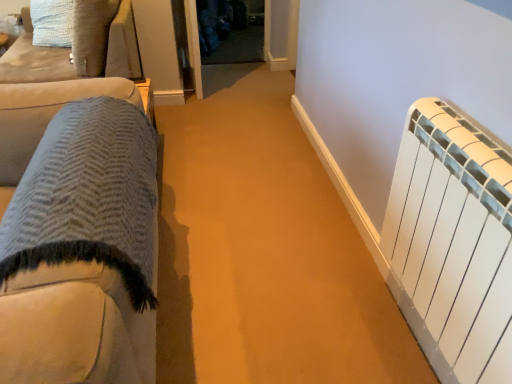
Question: Considering the relative positions of textured wool blanket at left, positioned as the 2th furniture in top-to-bottom order, and transparent glass door at center in the image provided, is textured wool blanket at left, positioned as the 2th furniture in top-to-bottom order, to the left of transparent glass door at center from the viewer's perspective?

Choices:
 (A) yes
 (B) no

Answer: (A)

Question: Can you confirm if textured wool blanket at left, acting as the 1th furniture starting from the right, is positioned to the right of transparent glass door at center?

Choices:
 (A) yes
 (B) no

Answer: (B)

Question: Is textured wool blanket at left, the first furniture from the front, not near transparent glass door at center?

Choices:
 (A) no
 (B) yes

Answer: (B)

Question: Could you tell me if textured wool blanket at left, which is counted as the 2th furniture, starting from the back, is turned towards transparent glass door at center?

Choices:
 (A) yes
 (B) no

Answer: (B)

Question: Would you say transparent glass door at center is part of textured wool blanket at left, which is counted as the 2th furniture, starting from the back,'s contents?

Choices:
 (A) no
 (B) yes

Answer: (A)

Question: From the image's perspective, relative to white matte radiator at right, is suede cushion at upper left, positioned as the 2th furniture in right-to-left order, above or below?

Choices:
 (A) below
 (B) above

Answer: (B)

Question: Based on their sizes in the image, would you say suede cushion at upper left, placed as the first furniture when sorted from back to front, is bigger or smaller than white matte radiator at right?

Choices:
 (A) big
 (B) small

Answer: (A)

Question: In terms of width, does suede cushion at upper left, which ranks as the first furniture in left-to-right order, look wider or thinner when compared to white matte radiator at right?

Choices:
 (A) thin
 (B) wide

Answer: (B)

Question: From a real-world perspective, is suede cushion at upper left, arranged as the second furniture when viewed from the front, above or below white matte radiator at right?

Choices:
 (A) above
 (B) below

Answer: (A)

Question: Would you say white matte radiator at right is to the left or to the right of suede cushion at upper left, arranged as the second furniture when viewed from the front, in the picture?

Choices:
 (A) right
 (B) left

Answer: (A)

Question: Is white matte radiator at right taller or shorter than suede cushion at upper left, positioned as the second furniture in bottom-to-top order?

Choices:
 (A) short
 (B) tall

Answer: (B)

Question: Is white matte radiator at right bigger or smaller than suede cushion at upper left, arranged as the second furniture when viewed from the front?

Choices:
 (A) big
 (B) small

Answer: (B)

Question: Is white matte radiator at right inside or outside of suede cushion at upper left, positioned as the 2th furniture in right-to-left order?

Choices:
 (A) inside
 (B) outside

Answer: (B)

Question: In terms of size, does textured wool blanket at left, positioned as the 2th furniture in top-to-bottom order, appear bigger or smaller than transparent glass door at center?

Choices:
 (A) small
 (B) big

Answer: (B)

Question: Is textured wool blanket at left, acting as the 1th furniture starting from the right, spatially inside transparent glass door at center, or outside of it?

Choices:
 (A) inside
 (B) outside

Answer: (B)